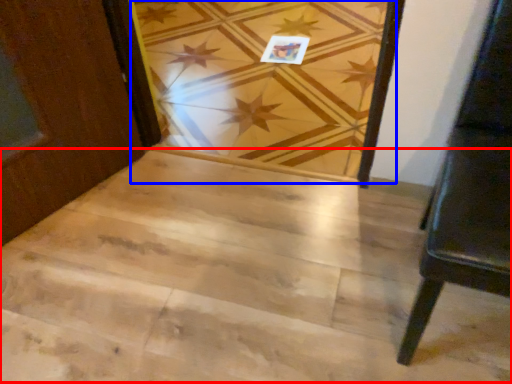
Question: Which object appears farthest to the camera in this image, stairwell (highlighted by a red box) or plank (highlighted by a blue box)?

Choices:
 (A) stairwell
 (B) plank

Answer: (B)